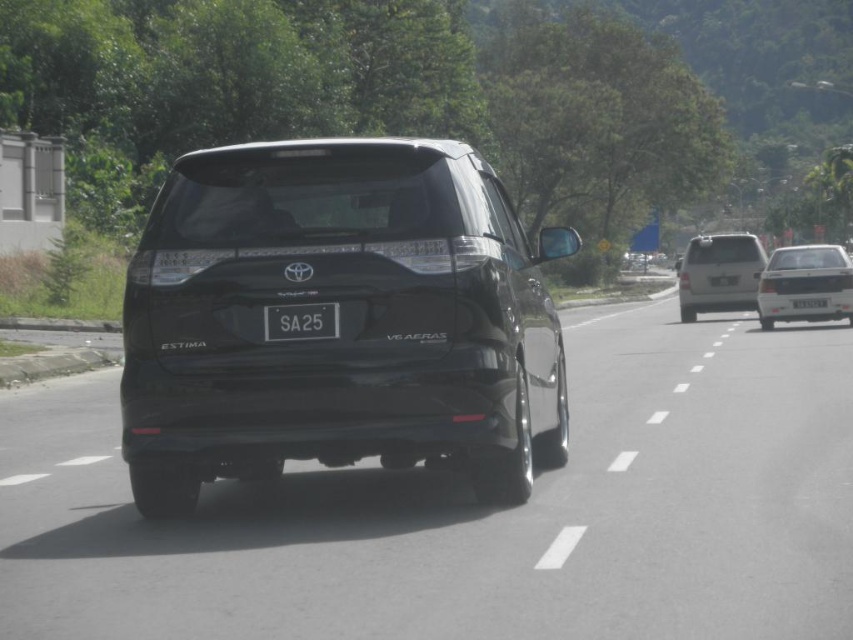
Question: Considering the relative positions of white glossy sedan at right and black plastic license plate at center in the image provided, where is white glossy sedan at right located with respect to black plastic license plate at center?

Choices:
 (A) below
 (B) above

Answer: (B)

Question: Estimate the real-world distances between objects in this image. Which object is farther from the white plastic license plate at center?

Choices:
 (A) black plastic license plate at center
 (B) black glossy suv at center
 (C) white glossy sedan at right

Answer: (A)

Question: Can you confirm if black glossy suv at center is positioned to the left of black plastic license plate at center?

Choices:
 (A) yes
 (B) no

Answer: (B)

Question: Which point is farther to the camera?

Choices:
 (A) (759, 312)
 (B) (460, 268)

Answer: (A)

Question: Does white glossy sedan at right come in front of matte silver minivan at center?

Choices:
 (A) yes
 (B) no

Answer: (A)

Question: Which point appears closest to the camera in this image?

Choices:
 (A) (306, 305)
 (B) (700, 308)
 (C) (503, 461)

Answer: (A)